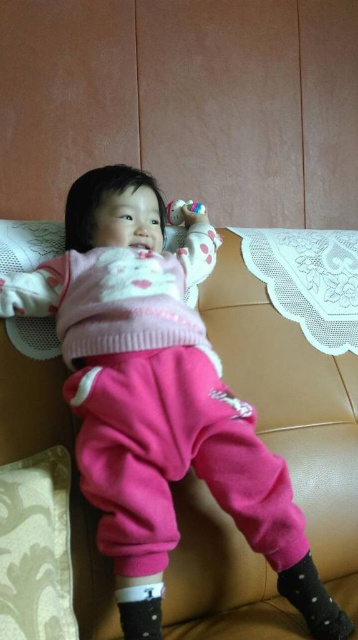
You are taking a photo of the child on the couch. You want to focus on the point closer to the camera. Which point should you choose between point (x=176, y=387) and point (x=47, y=486)?

Point (x=176, y=387) is further to the camera than point (x=47, y=486), so you should choose point (x=176, y=387) to focus on the closer point.

You are a parent trying to decide whether to place a small decorative item on the couch where the child is lying. The item is the same size as the translucent plastic toy at upper center. Based on the scene, will the pink fleece sweater at upper center block the view of the decorative item from above?

The pink fleece sweater at upper center has a larger size compared to the translucent plastic toy at upper center. Since the decorative item is the same size as the translucent plastic toy, the sweater will block the view of the decorative item from above due to its larger size.